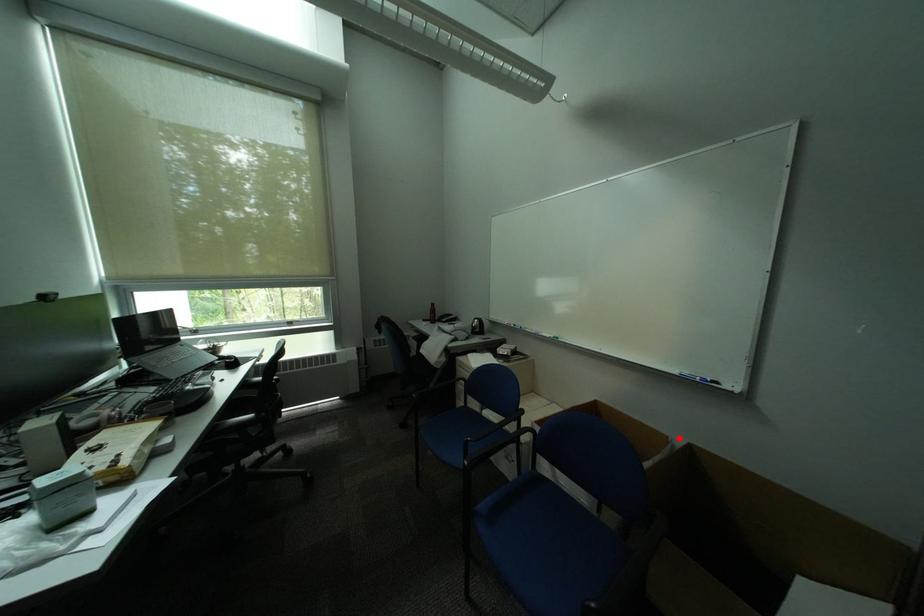
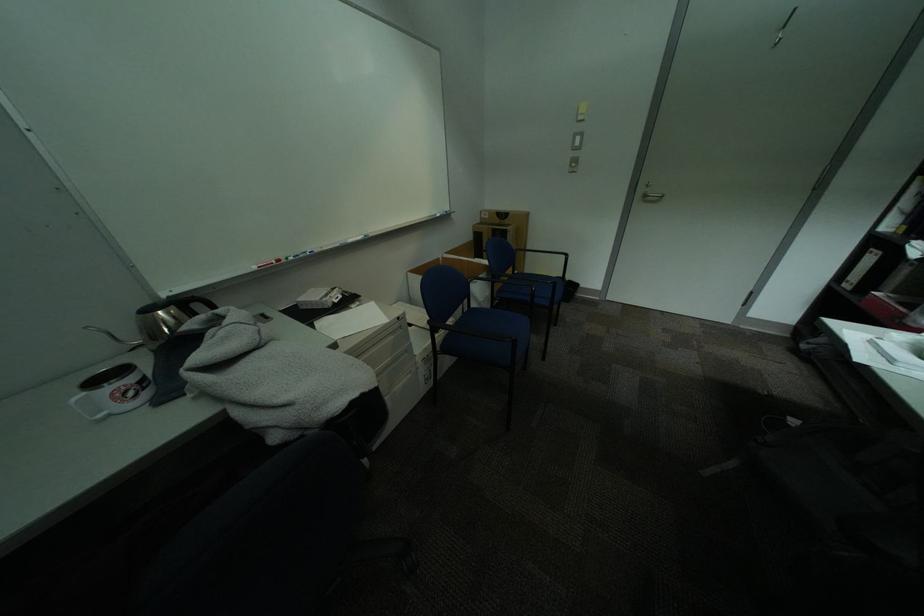
The point at the highlighted location is marked in the first image. Where is the corresponding point in the second image?

(450, 259)